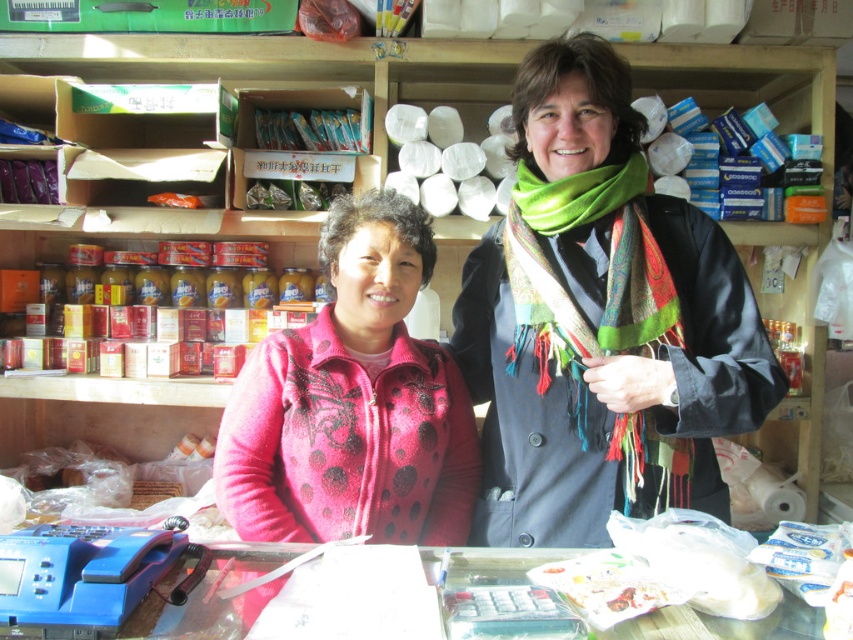
Measure the distance between pink dotted sweater at center and green woven scarf at center.

The distance of pink dotted sweater at center from green woven scarf at center is 11.51 inches.

I want to click on pink dotted sweater at center, so click(352, 403).

Is point (613, 301) behind point (540, 180)?

No.

Can you confirm if multicolored scarf at center is positioned to the left of green woven scarf at center?

Indeed, multicolored scarf at center is positioned on the left side of green woven scarf at center.

In the scene shown: Who is more forward, (x=674, y=288) or (x=537, y=244)?

Point (x=674, y=288)

Locate an element on the screen. Image resolution: width=853 pixels, height=640 pixels. multicolored scarf at center is located at coordinates (601, 323).

Does multicolored scarf at center have a greater height compared to pink dotted sweater at center?

Indeed, multicolored scarf at center has a greater height compared to pink dotted sweater at center.

Locate an element on the screen. The image size is (853, 640). multicolored scarf at center is located at coordinates (601, 323).